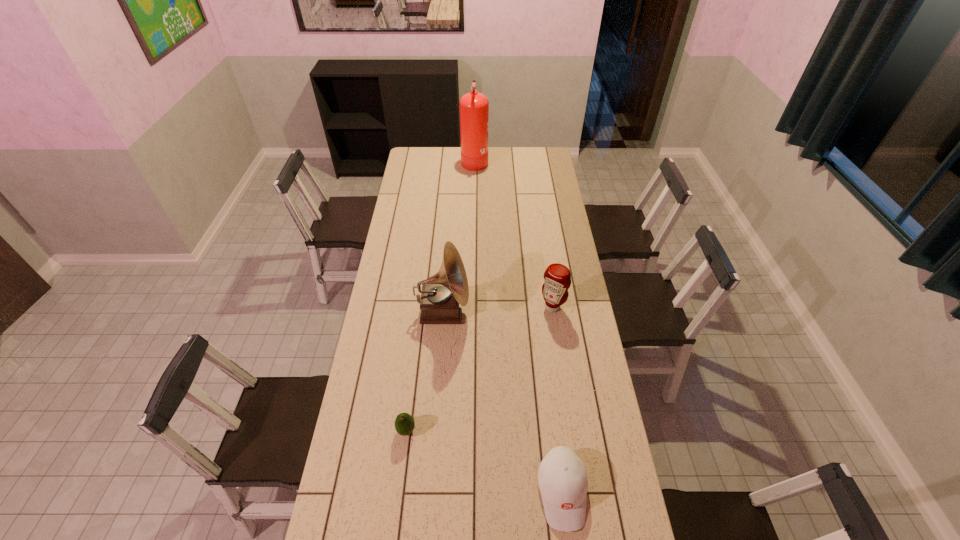
Image resolution: width=960 pixels, height=540 pixels. What are the coordinates of `vacant space that's between the phonograph record and the farthest object` in the screenshot? It's located at (459, 235).

I want to click on free space between the nearest object and the third shortest object, so click(558, 399).

Find the location of a particular element. Image resolution: width=960 pixels, height=540 pixels. vacant space in between the fire extinguisher and the third tallest object is located at coordinates (514, 233).

Identify the location of unoccupied position between the baseball cap and the phonograph record. (502, 402).

Where is `empty location between the fire extinguisher and the baseball cap`? empty location between the fire extinguisher and the baseball cap is located at coordinates (518, 326).

You are a GUI agent. You are given a task and a screenshot of the screen. Output one action in this format:
    pyautogui.click(x=<x>, y=<y>)
    Task: Click on the free spot between the third tallest object and the phonograph record
    The width and height of the screenshot is (960, 540).
    Given the screenshot: What is the action you would take?
    pyautogui.click(x=497, y=309)

The image size is (960, 540). I want to click on free space between the nearest object and the avocado, so click(x=484, y=461).

Find the location of a particular element. object that is the fourth closest to the fourth shortest object is located at coordinates (474, 107).

Where is `object that is the second closest one to the phonograph record`? object that is the second closest one to the phonograph record is located at coordinates (404, 423).

At what (x,y) coordinates should I click in order to perform the action: click on blank space that satisfies the following two spatial constraints: 1. towards the nozzle of the fire extinguisher; 2. on the right side of the condiment. Please return your answer as a coordinate pair (x, y). Looking at the image, I should click on (472, 307).